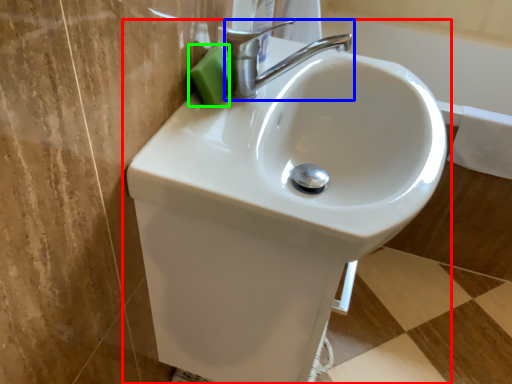
Question: Which object is positioned farthest from sink (highlighted by a red box)? Select from tap (highlighted by a blue box) and soap (highlighted by a green box).

Choices:
 (A) tap
 (B) soap

Answer: (B)